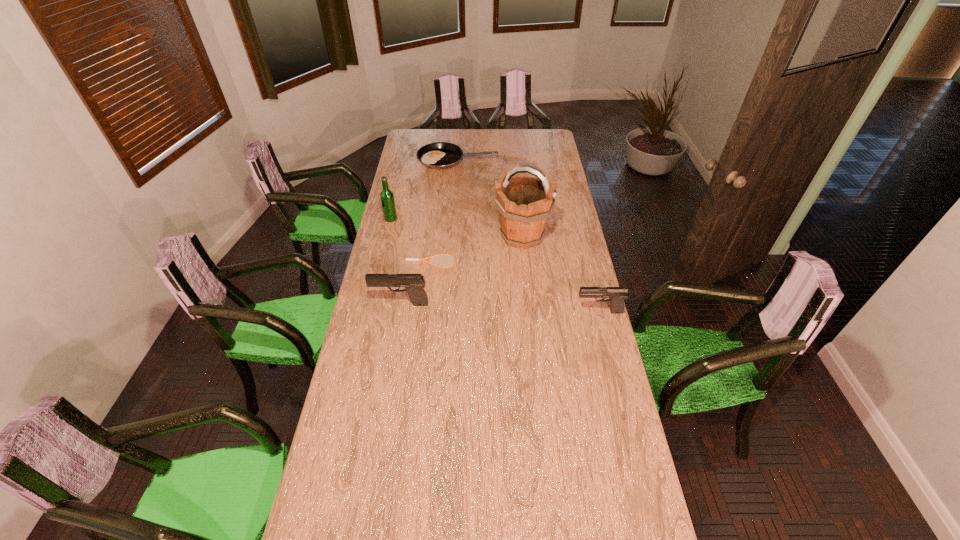
Locate an element on the screen. vacant space that's between the left pistol and the second shortest object is located at coordinates (429, 232).

Find the location of `empty location between the right pistol and the left pistol`. empty location between the right pistol and the left pistol is located at coordinates (500, 308).

Locate an element on the screen. vacant area that lies between the fifth shortest object and the second nearest object is located at coordinates (396, 261).

The height and width of the screenshot is (540, 960). Find the location of `free space between the right pistol and the shortest object`. free space between the right pistol and the shortest object is located at coordinates (515, 287).

Locate an element on the screen. free space between the second shortest object and the bucket is located at coordinates (490, 198).

At what (x,y) coordinates should I click in order to perform the action: click on object that is the second closest to the tennis racket. Please return your answer as a coordinate pair (x, y). This screenshot has width=960, height=540. Looking at the image, I should click on (414, 283).

Identify which object is the closest to the farthest object. Please provide its 2D coordinates. Your answer should be formatted as a tuple, i.e. [(x, y)], where the tuple contains the x and y coordinates of a point satisfying the conditions above.

[(387, 197)]